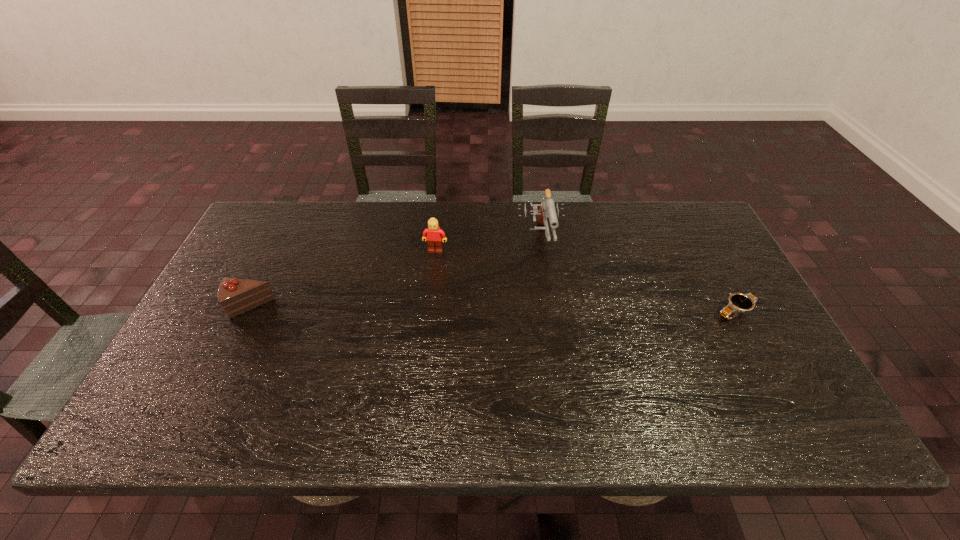
I want to click on empty location between the second object from left to right and the rightmost object, so 586,281.

I want to click on empty location between the chocolate cake and the Lego, so click(343, 279).

Locate an element on the screen. This screenshot has width=960, height=540. unoccupied area between the rightmost object and the leftmost object is located at coordinates (492, 309).

Where is `free spot between the second object from right to left and the shortest object`? free spot between the second object from right to left and the shortest object is located at coordinates (637, 276).

Identify the location of free point between the third object from right to left and the leftmost object. (343, 279).

This screenshot has width=960, height=540. Identify the location of empty space between the Lego and the shortest object. (586, 281).

The width and height of the screenshot is (960, 540). What are the coordinates of `empty space between the third object from right to left and the chocolate cake` in the screenshot? It's located at (343, 279).

Identify the location of free space between the second object from left to right and the watch. (586, 281).

The height and width of the screenshot is (540, 960). In order to click on the closest object relative to the Lego in this screenshot , I will do click(x=547, y=208).

Identify which object is the third closest to the Lego. Please provide its 2D coordinates. Your answer should be formatted as a tuple, i.e. [(x, y)], where the tuple contains the x and y coordinates of a point satisfying the conditions above.

[(737, 303)]